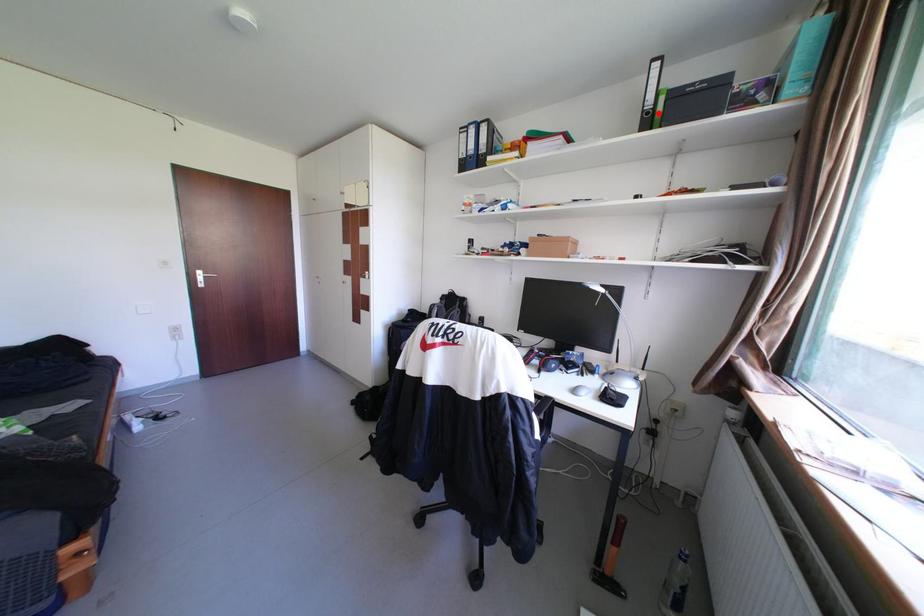
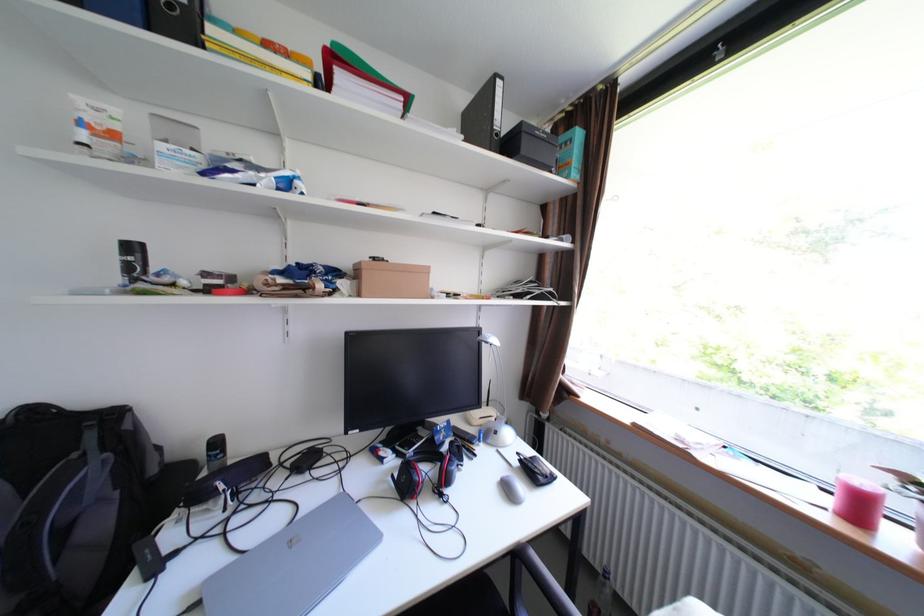
The point at the highlighted location is marked in the first image. Where is the corresponding point in the second image?

(507, 135)